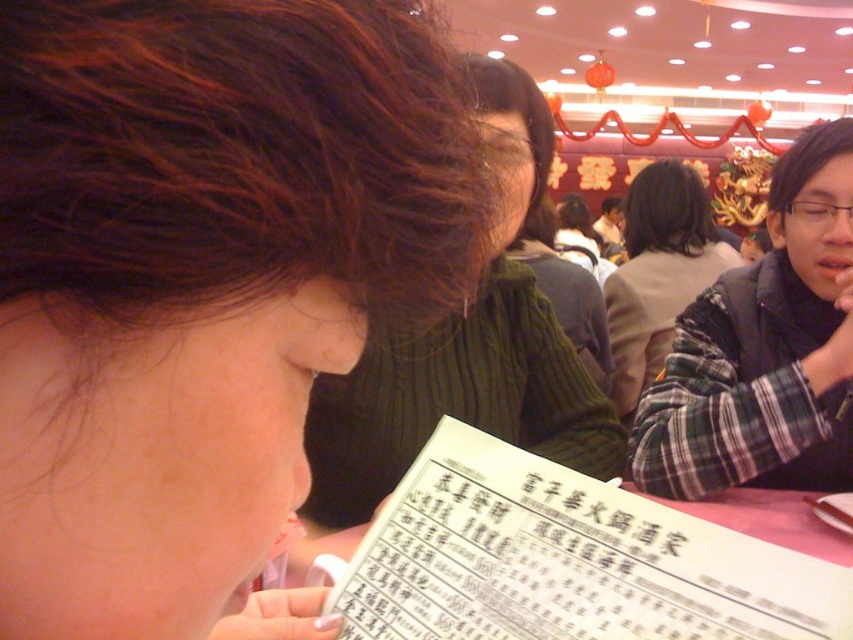
You are a photographer trying to capture a candid shot of the green knitted sweater at center without the brown matte hair at upper left blocking it. Can you adjust your position to do so?

The brown matte hair at upper left is in front of the green knitted sweater at center, so moving your position to the side or behind the brown matte hair at upper left would allow you to capture the green knitted sweater at center without obstruction.

You are a guest in the restaurant and want to read the white paper menu at center without moving your head. Can you see the brown matte hair at upper left blocking your view of the menu?

The brown matte hair at upper left is above the white paper menu at center, so it might block your view of the menu if it is positioned in front of it.